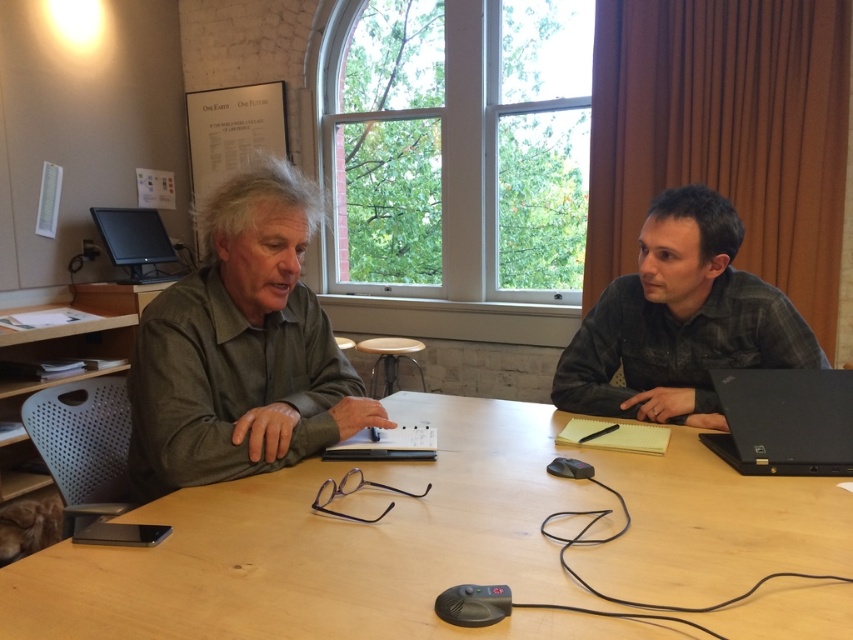
Question: Can you confirm if green matte shirt at left is wider than wooden table at center?

Choices:
 (A) yes
 (B) no

Answer: (A)

Question: Estimate the real-world distances between objects in this image. Which object is closer to the plaid shirt at right?

Choices:
 (A) green matte shirt at left
 (B) light brown wood table at center
 (C) matte black monitor at upper left

Answer: (B)

Question: Can you confirm if matte black monitor at upper left is positioned to the right of wooden table at center?

Choices:
 (A) no
 (B) yes

Answer: (A)

Question: In this image, where is light brown wood table at center located relative to matte black monitor at upper left?

Choices:
 (A) right
 (B) left

Answer: (A)

Question: Which point is closer to the camera taking this photo?

Choices:
 (A) (741, 465)
 (B) (125, 211)
 (C) (694, 632)
 (D) (271, 355)

Answer: (C)

Question: Which is farther from the wooden table at center?

Choices:
 (A) light brown wood table at center
 (B) matte black monitor at upper left
 (C) black matte laptop at right
 (D) green matte shirt at left

Answer: (C)